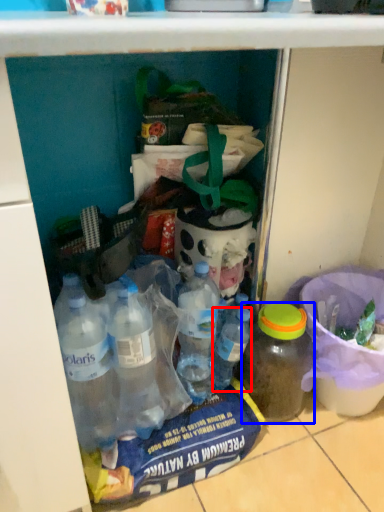
Question: Among these objects, which one is nearest to the camera, bottle (highlighted by a red box) or bottle (highlighted by a blue box)?

Choices:
 (A) bottle
 (B) bottle

Answer: (B)